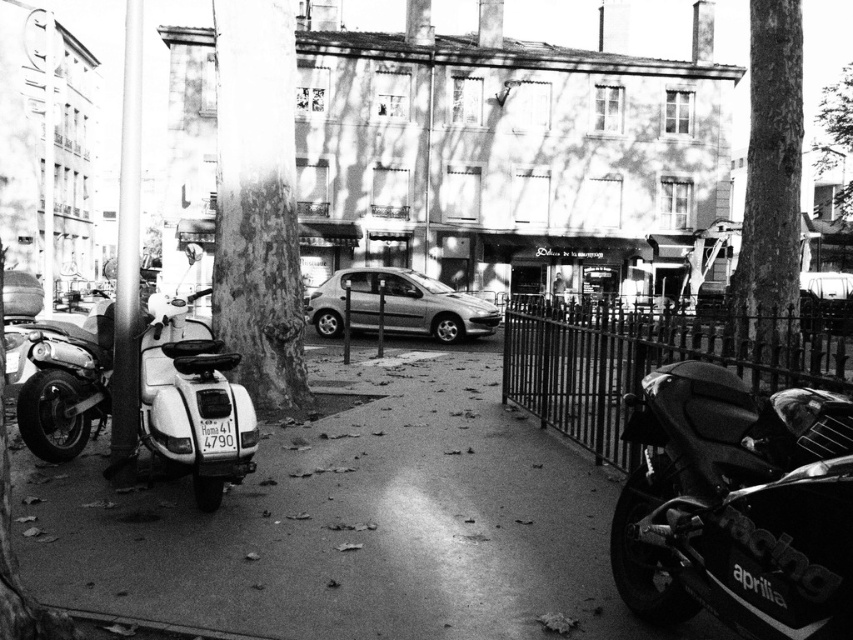
You are a pedestrian standing on the sidewalk and want to walk to the smooth bark tree at center. Is the white matte scooter at left blocking your path?

The white matte scooter at left is behind the smooth bark tree at center, so it is not blocking your path to the smooth bark tree at center.

You are a city planner analyzing this urban scene. You need to determine which of the two objects, the smooth bark tree at center or the dark iron fence at right, requires more space for maintenance. Based on their sizes, which one likely needs more room?

The dark iron fence at right likely needs more space for maintenance because the smooth bark tree at center has a smaller size compared to it.

You are standing at the point marked by the coordinates point (352, 520) in the image. What type of surface are you standing on?

The surface at point (352, 520) is smooth asphalt pavement at center.